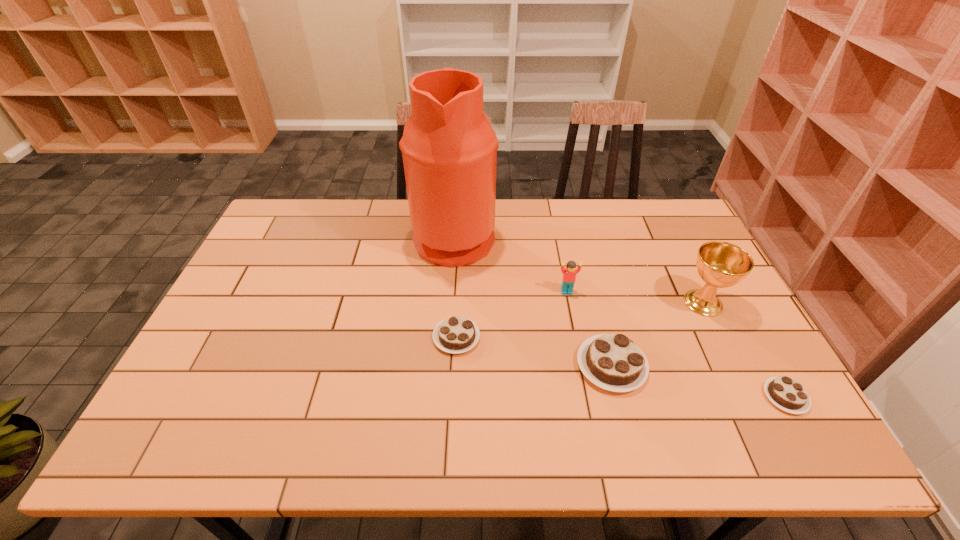
Find the location of a particular element. free spot located on the left of the second shortest chocolate cake is located at coordinates (384, 337).

Where is `free space located 0.240m on the back of the second chocolate cake from right to left`? The image size is (960, 540). free space located 0.240m on the back of the second chocolate cake from right to left is located at coordinates pyautogui.click(x=588, y=275).

Where is `free point located 0.150m on the left of the rightmost chocolate cake`? free point located 0.150m on the left of the rightmost chocolate cake is located at coordinates (702, 397).

In order to click on vacant space positioned from the spout of the farthest object in this screenshot , I will do (x=612, y=236).

The image size is (960, 540). Find the location of `vacant space located on the back of the fifth shortest object`. vacant space located on the back of the fifth shortest object is located at coordinates 673,241.

The height and width of the screenshot is (540, 960). I want to click on vacant space located 0.100m on the face of the Lego, so click(572, 321).

The width and height of the screenshot is (960, 540). Identify the location of object that is positioned at the far edge. (449, 148).

Find the location of a particular element. chocolate cake that is at the right edge is located at coordinates pyautogui.click(x=786, y=393).

Where is `chalice at the right edge`? This screenshot has width=960, height=540. chalice at the right edge is located at coordinates (720, 264).

Find the location of a particular element. The image size is (960, 540). object that is at the near right corner is located at coordinates (786, 393).